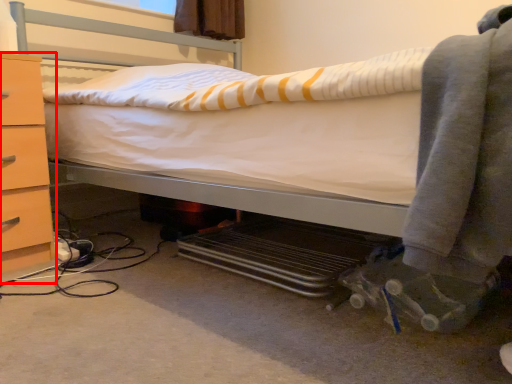
Question: From the image's perspective, where is chest of drawers (annotated by the red box) located in relation to clothing in the image?

Choices:
 (A) below
 (B) above

Answer: (A)